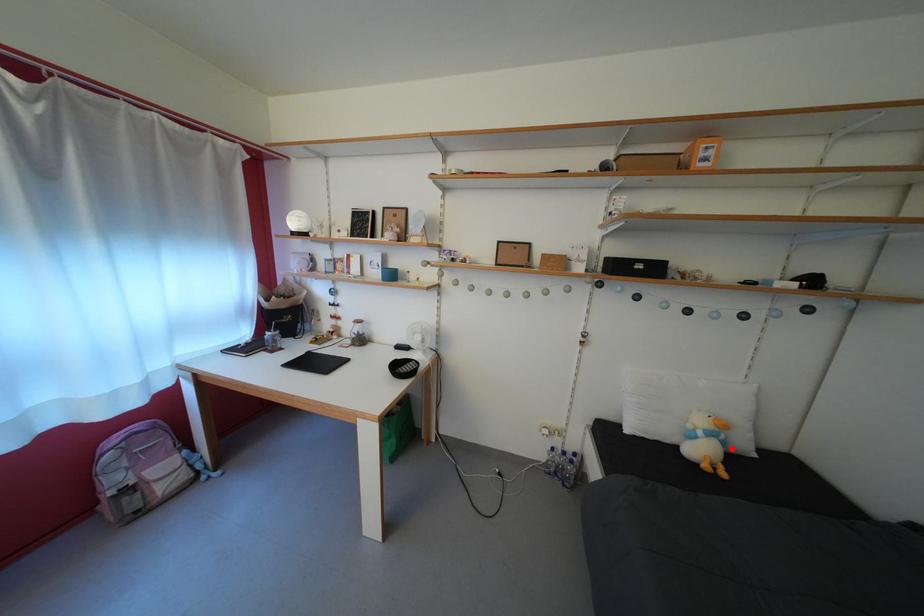
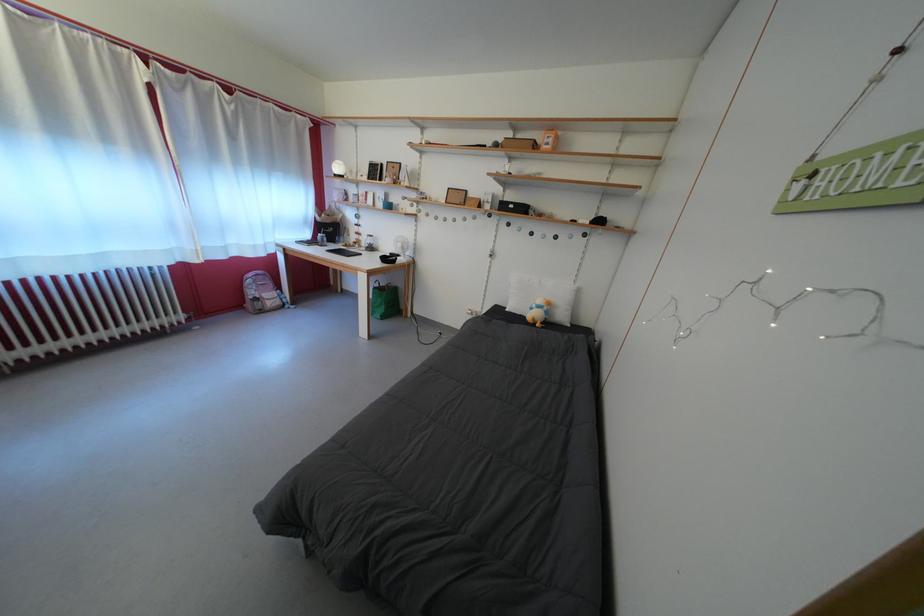
Question: I am providing you with two images of the same scene from different viewpoints. In image1, a red point is highlighted. Considering the same 3D point in image2, which of the following is correct?

Choices:
 (A) It is closer
 (B) It is farther

Answer: (A)